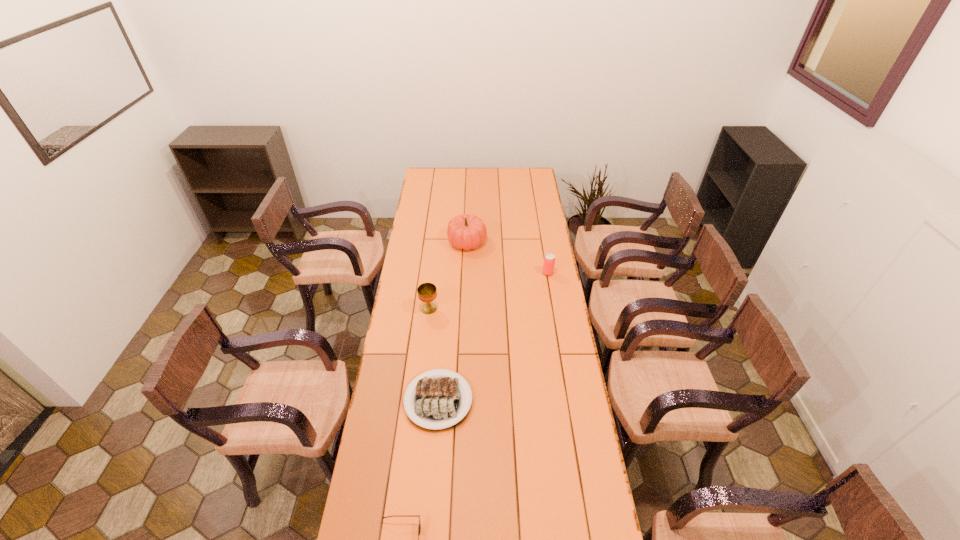
This screenshot has height=540, width=960. I want to click on pumpkin, so [465, 231].

This screenshot has height=540, width=960. Identify the location of chalice. (427, 292).

The width and height of the screenshot is (960, 540). I want to click on the second farthest object, so click(549, 260).

The width and height of the screenshot is (960, 540). I want to click on the third shortest object, so click(549, 260).

This screenshot has width=960, height=540. What are the coordinates of `plate` in the screenshot? It's located at (437, 401).

This screenshot has width=960, height=540. What are the coordinates of `free spot located 0.050m on the front of the farthest object` in the screenshot? It's located at (467, 261).

Where is `free spot located on the right of the chalice`? This screenshot has height=540, width=960. free spot located on the right of the chalice is located at coordinates (487, 309).

At what (x,y) coordinates should I click in order to perform the action: click on free space located on the front of the rightmost object. Please return your answer as a coordinate pair (x, y). The image size is (960, 540). Looking at the image, I should click on (554, 310).

Find the location of `vacant space located 0.200m on the front of the plate`. vacant space located 0.200m on the front of the plate is located at coordinates (430, 498).

The width and height of the screenshot is (960, 540). Find the location of `chalice located in the left edge section of the desktop`. chalice located in the left edge section of the desktop is located at coordinates (427, 292).